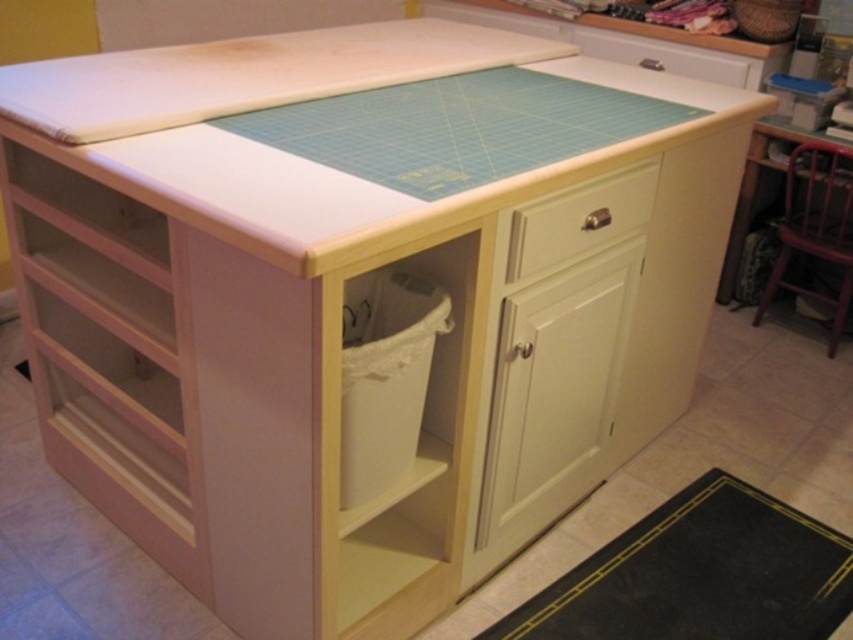
Between point (839, 150) and point (512, 275), which one is positioned behind?

The point (839, 150) is behind.

What do you see at coordinates (816, 225) in the screenshot? The width and height of the screenshot is (853, 640). I see `wooden chair at right` at bounding box center [816, 225].

Find the location of `wooden chair at right`. wooden chair at right is located at coordinates (816, 225).